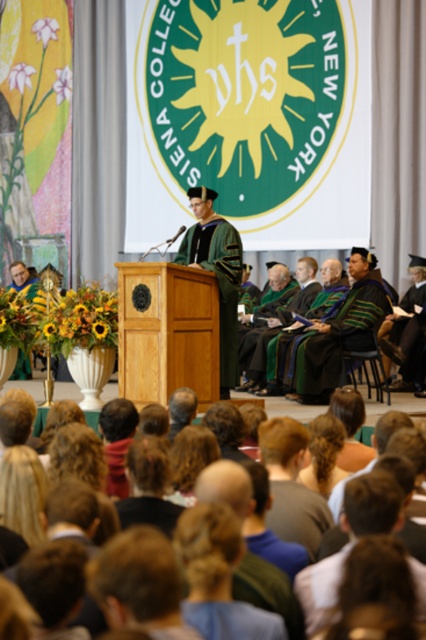
You are a photographer at the graduation ceremony. You want to capture a photo of the green velvet gown at center. Where should you position your camera to ensure the gown is centered in the frame?

Position the camera at point (216, 273) to center the green velvet gown at center in the frame.

Consider the image. You are a photographer at the graduation ceremony. You need to take a photo of both the green velvet gown at center and the green velvet robe at center. However, the robe is partially blocking the gown. Can you adjust your position to capture both clearly without moving any objects?

The green velvet gown at center is in front of the green velvet robe at center. To capture both clearly, move your camera position slightly so that you can see around the gown to include the robe in the background without obstruction.